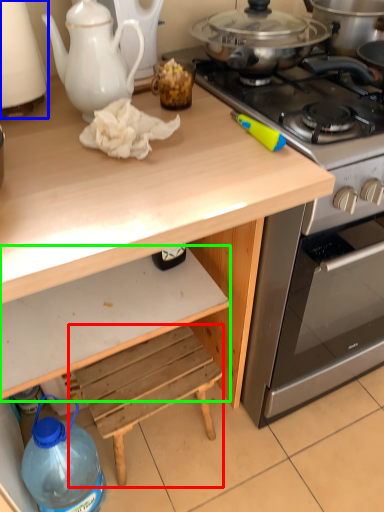
Question: Estimate the real-world distances between objects in this image. Which object is farther from step stool (highlighted by a red box), kitchen appliance (highlighted by a blue box) or drawer (highlighted by a green box)?

Choices:
 (A) kitchen appliance
 (B) drawer

Answer: (A)